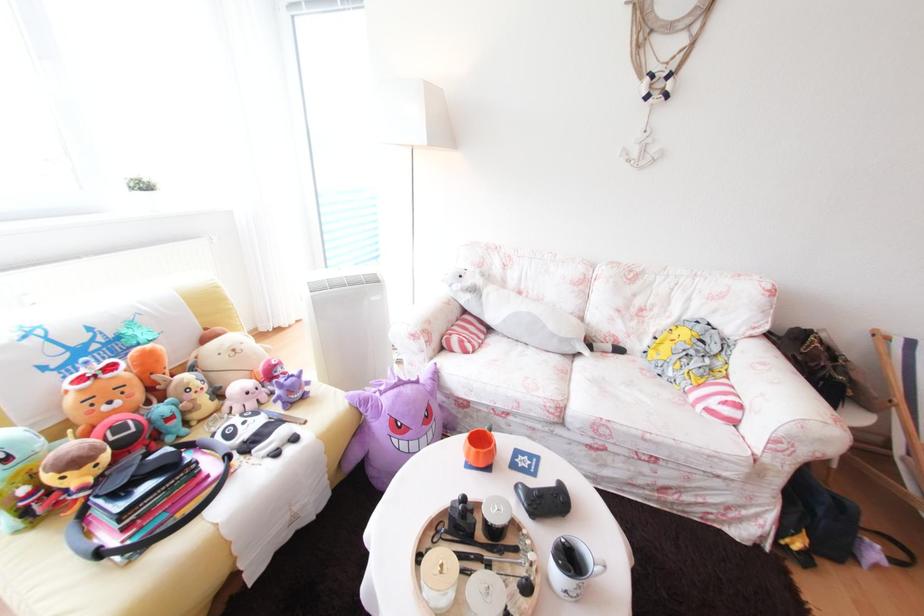
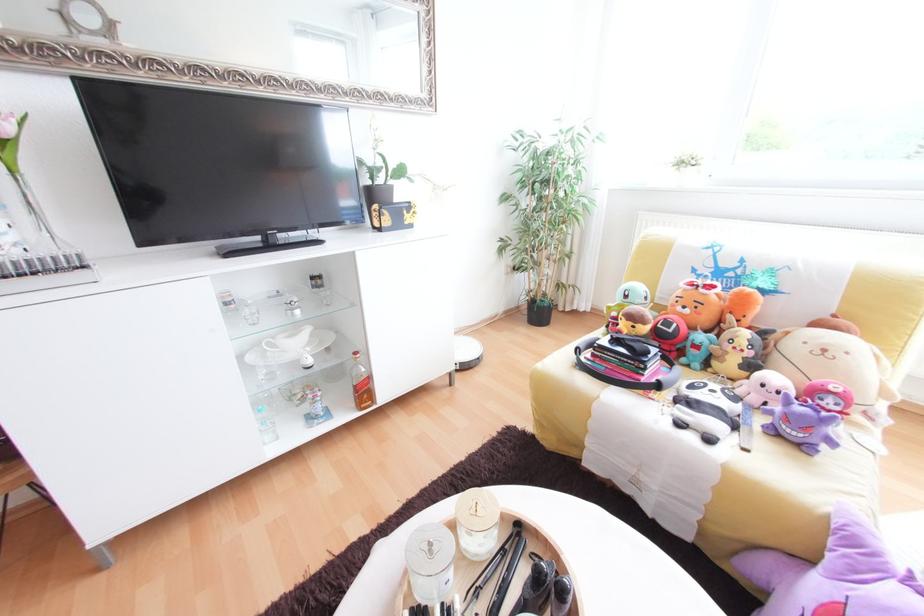
Locate, in the second image, the point that corresponds to point 177,419 in the first image.

(704, 347)